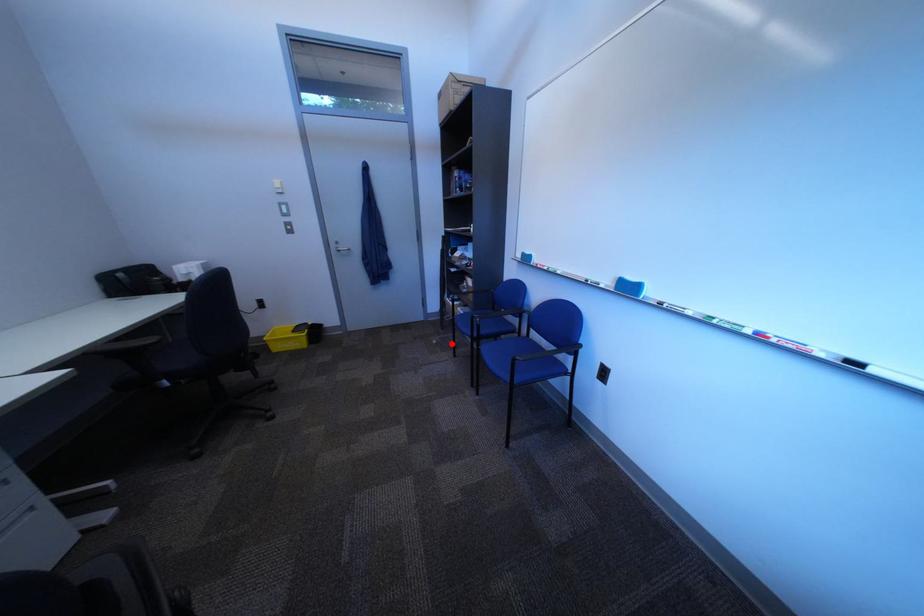
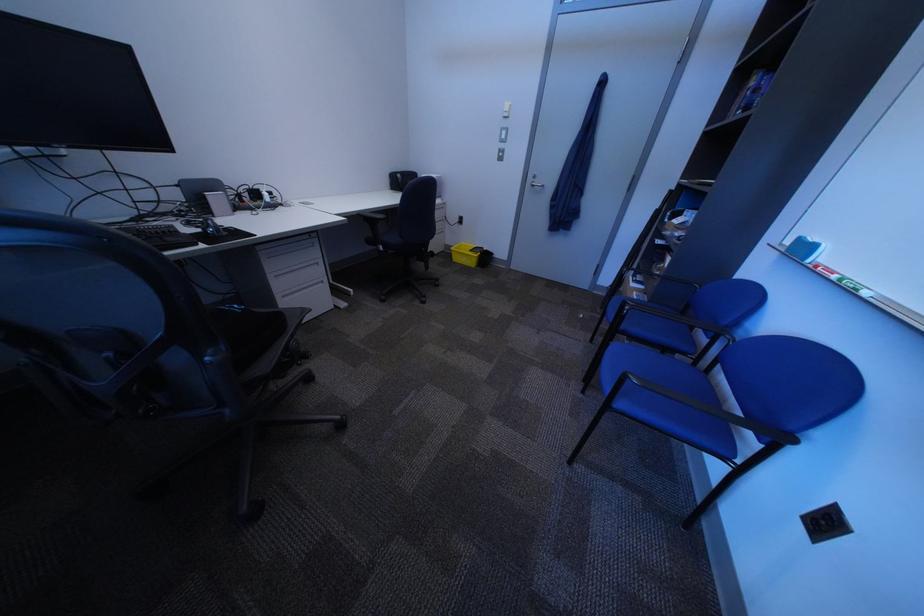
The point at the highlighted location is marked in the first image. Where is the corresponding point in the second image?

(599, 318)